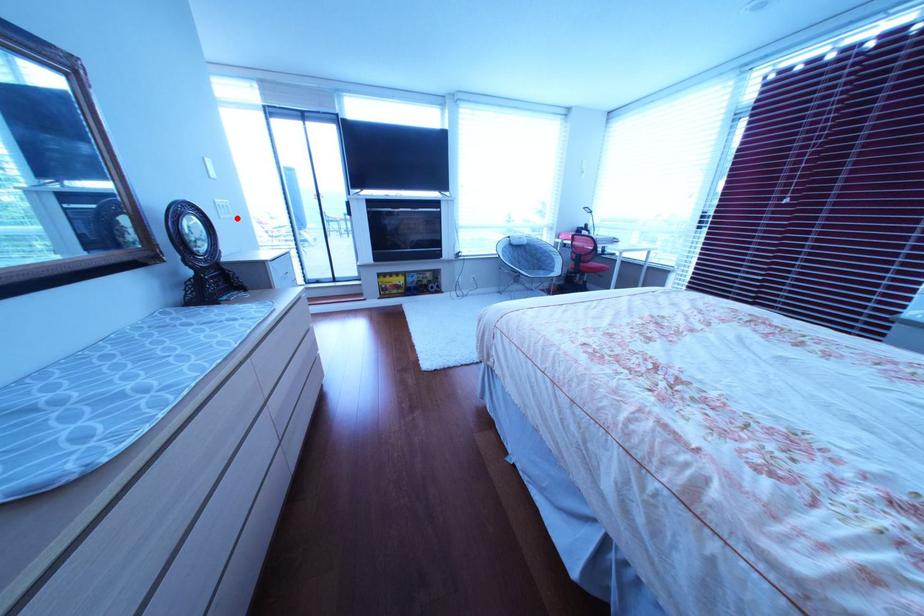
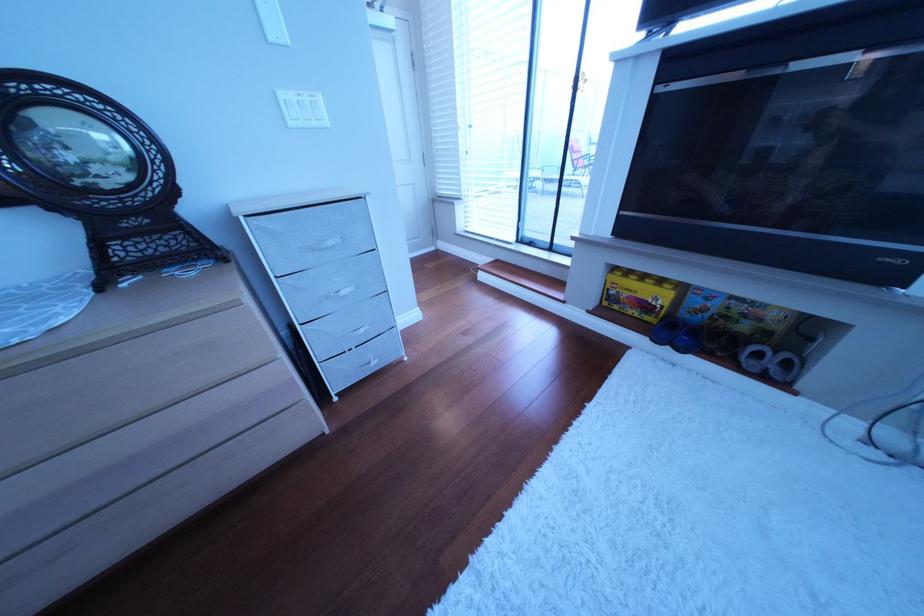
Question: I am providing you with two images of the same scene from different viewpoints. A red point is shown in image1. For the corresponding object point in image2, is it positioned nearer or farther from the camera?

Choices:
 (A) Nearer
 (B) Farther

Answer: (B)